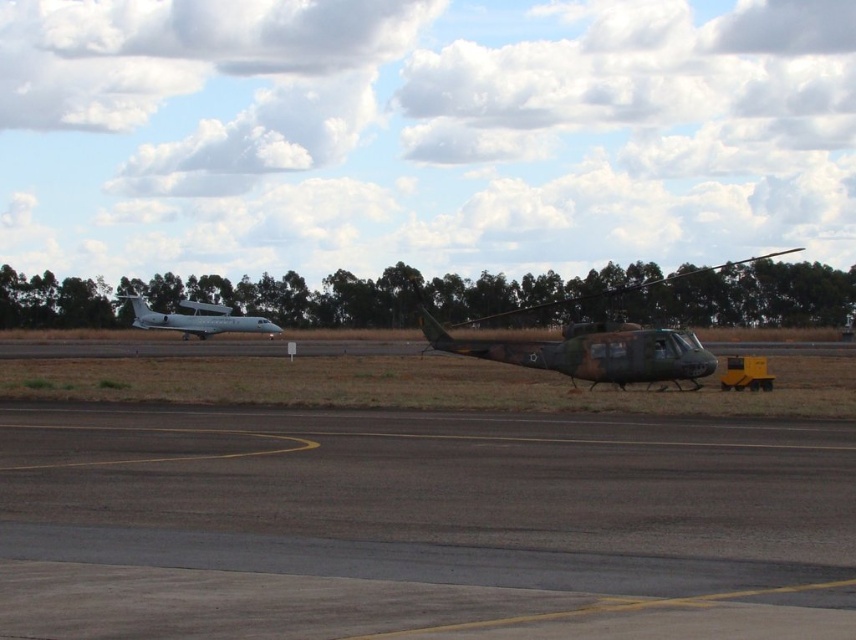
You are a pilot preparing to land your small aircraft. You see the dark gray asphalt at center and the silver metallic airplane at left. Which one is closer to your current position as you approach the runway?

The dark gray asphalt at center is closer to your current position because it is in front of the silver metallic airplane at left, meaning it is nearer to you as you approach the runway.

You are a pilot preparing to land your small aircraft. You notice the dark gray asphalt at center and the silver metallic airplane at left. Which one is larger in size?

The silver metallic airplane at left is larger than the dark gray asphalt at center.